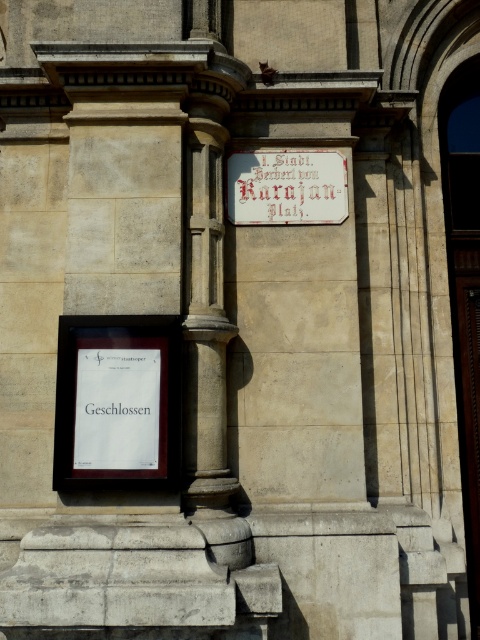
Which of these two, white wood sign at center or white paper sign at lower left, stands shorter?

Standing shorter between the two is white paper sign at lower left.

Which is in front, point (319, 205) or point (81, 410)?

Point (81, 410) is more forward.

You are a GUI agent. You are given a task and a screenshot of the screen. Output one action in this format:
    pyautogui.click(x=<x>, y=<y>)
    Task: Click on the white wood sign at center
    The image size is (480, 640).
    Given the screenshot: What is the action you would take?
    pyautogui.click(x=286, y=186)

Between white paper poster at lower left and white wood sign at center, which one has less height?

With less height is white wood sign at center.

Between white paper poster at lower left and white wood sign at center, which one is positioned lower?

white paper poster at lower left is below.

Who is more forward, (149, 381) or (274, 161)?

Positioned in front is point (149, 381).

Image resolution: width=480 pixels, height=640 pixels. I want to click on white paper poster at lower left, so click(x=117, y=408).

Is white paper poster at lower left bigger than white paper sign at lower left?

Correct, white paper poster at lower left is larger in size than white paper sign at lower left.

Is point (92, 451) positioned after point (95, 406)?

No, it is not.

Locate an element on the screen. The image size is (480, 640). white paper poster at lower left is located at coordinates (117, 408).